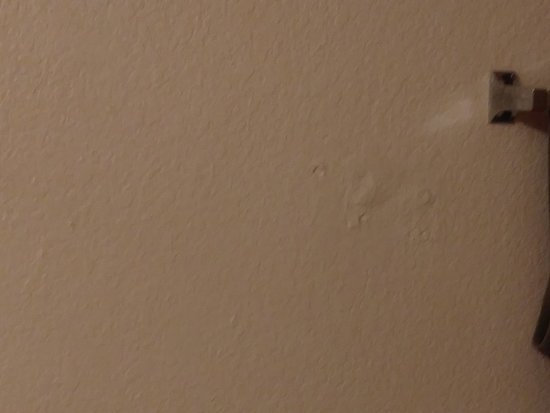
Identify the location of wall to the left of towel rack. The image size is (550, 413). (421, 100).